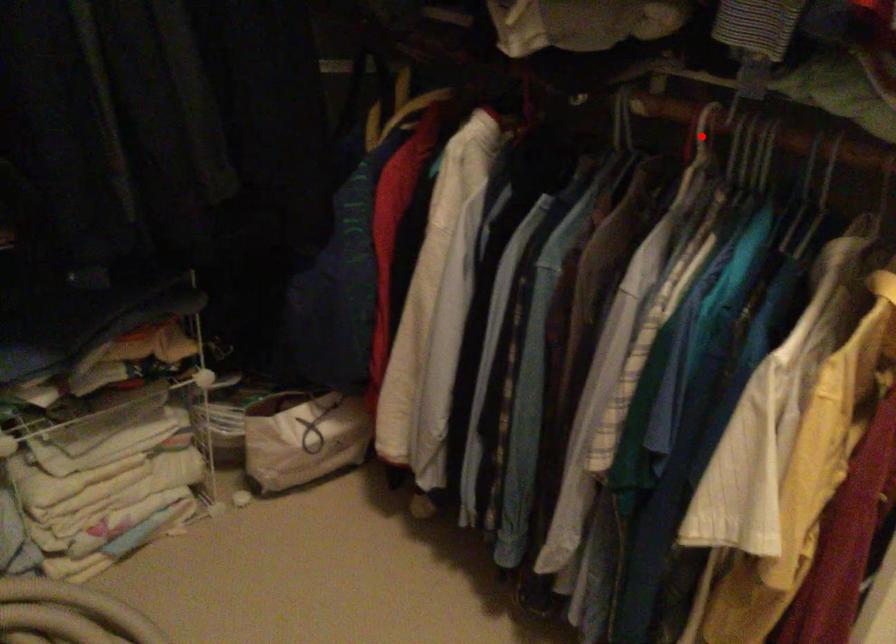
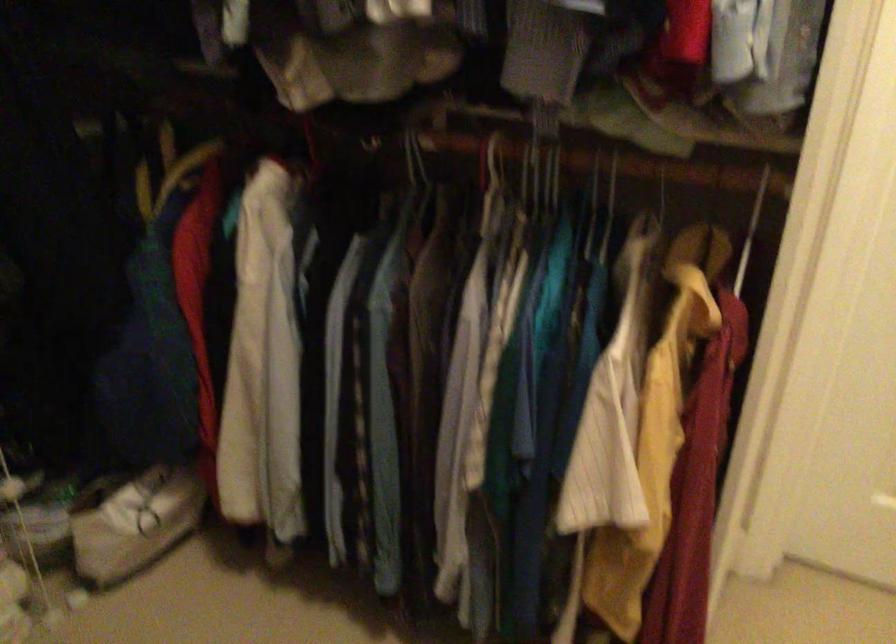
Find the pixel in the second image that matches the highlighted location in the first image.

(494, 161)